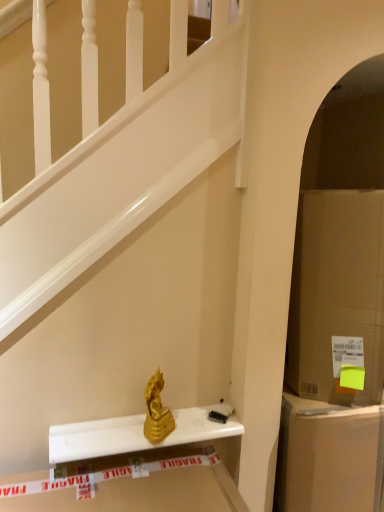
Question: Is gold metallic statue at center further to camera compared to cardboard box at right?

Choices:
 (A) no
 (B) yes

Answer: (A)

Question: Is cardboard box at right at the back of gold metallic statue at center?

Choices:
 (A) yes
 (B) no

Answer: (B)

Question: Is gold metallic statue at center next to cardboard box at right and touching it?

Choices:
 (A) no
 (B) yes

Answer: (A)

Question: Considering the relative sizes of gold metallic statue at center and cardboard box at right in the image provided, is gold metallic statue at center bigger than cardboard box at right?

Choices:
 (A) yes
 (B) no

Answer: (B)

Question: Is gold metallic statue at center oriented towards cardboard box at right?

Choices:
 (A) yes
 (B) no

Answer: (B)

Question: Does gold metallic statue at center appear on the right side of cardboard box at right?

Choices:
 (A) no
 (B) yes

Answer: (A)

Question: Is cardboard box at right closer to the viewer compared to gold metallic statue at center?

Choices:
 (A) yes
 (B) no

Answer: (B)

Question: Can you confirm if cardboard box at right is shorter than gold metallic statue at center?

Choices:
 (A) no
 (B) yes

Answer: (A)

Question: Does cardboard box at right appear on the left side of gold metallic statue at center?

Choices:
 (A) yes
 (B) no

Answer: (B)

Question: Is the position of cardboard box at right more distant than that of gold metallic statue at center?

Choices:
 (A) yes
 (B) no

Answer: (A)

Question: From a real-world perspective, is cardboard box at right positioned over gold metallic statue at center based on gravity?

Choices:
 (A) no
 (B) yes

Answer: (A)

Question: Does cardboard box at right have a greater height compared to gold metallic statue at center?

Choices:
 (A) yes
 (B) no

Answer: (A)

Question: Does cardboard box at right come in front of cardboard box at right?

Choices:
 (A) no
 (B) yes

Answer: (A)